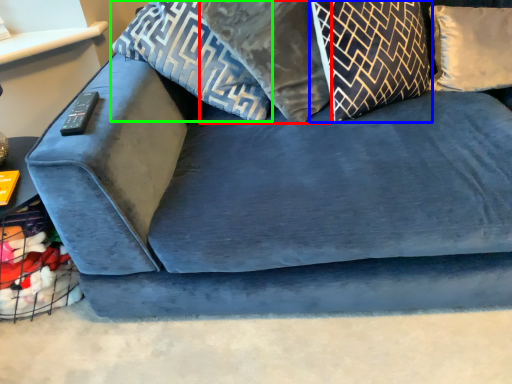
Question: Estimate the real-world distances between objects in this image. Which object is farther from pillow (highlighted by a red box), pillow (highlighted by a blue box) or pillow (highlighted by a green box)?

Choices:
 (A) pillow
 (B) pillow

Answer: (A)